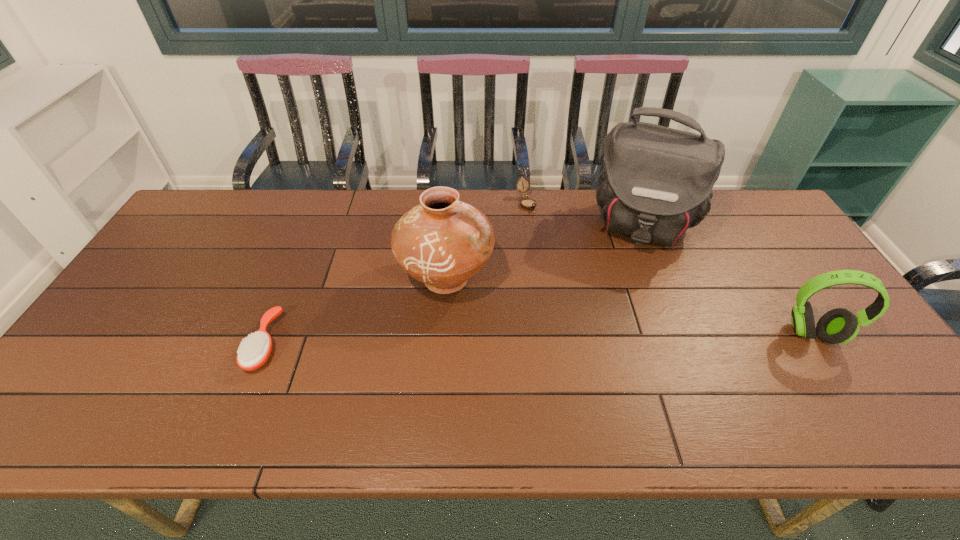
The image size is (960, 540). Find the location of `vacant region located 0.200m on the right of the shortest object`. vacant region located 0.200m on the right of the shortest object is located at coordinates (358, 343).

Where is `free space located 0.050m on the back of the third shortest object`? This screenshot has height=540, width=960. free space located 0.050m on the back of the third shortest object is located at coordinates (792, 303).

Image resolution: width=960 pixels, height=540 pixels. Find the location of `free space located on the face of the fourth tallest object`. free space located on the face of the fourth tallest object is located at coordinates (536, 223).

Identify the location of vacant point located 0.110m on the face of the fourth tallest object. click(x=542, y=234).

This screenshot has width=960, height=540. In order to click on free region located 0.090m on the face of the fourth tallest object in this screenshot , I will do `click(540, 231)`.

The width and height of the screenshot is (960, 540). In order to click on free spot located on the side of the second object from left to right with the handle in this screenshot , I will do `click(617, 365)`.

You are a GUI agent. You are given a task and a screenshot of the screen. Output one action in this format:
    pyautogui.click(x=<x>, y=<y>)
    Task: Click on the free location located 0.120m on the side of the second object from left to right with the handle
    
    Given the screenshot: What is the action you would take?
    pyautogui.click(x=523, y=318)

The width and height of the screenshot is (960, 540). In order to click on vacant region located on the side of the second object from left to right with the handle in this screenshot , I will do `click(575, 344)`.

Where is `free spot located 0.390m on the open flap of the shoulder bag`? The image size is (960, 540). free spot located 0.390m on the open flap of the shoulder bag is located at coordinates (612, 361).

The image size is (960, 540). What are the coordinates of `free space located 0.360m on the open flap of the shoulder bag` in the screenshot? It's located at (613, 351).